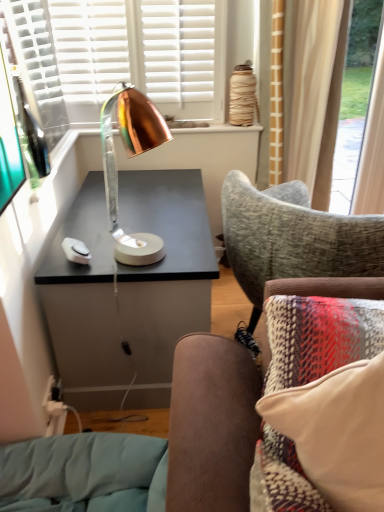
You are a GUI agent. You are given a task and a screenshot of the screen. Output one action in this format:
    pyautogui.click(x=<x>, y=<y>)
    Task: Click on the white soft pillow at lower right
    This screenshot has height=512, width=384.
    Given the screenshot: What is the action you would take?
    [x=337, y=432]

The image size is (384, 512). What do you see at coordinates (337, 432) in the screenshot? I see `white soft pillow at lower right` at bounding box center [337, 432].

Image resolution: width=384 pixels, height=512 pixels. What do you see at coordinates (130, 156) in the screenshot?
I see `copper metallic lamp at center` at bounding box center [130, 156].

Locate an element on the screen. The image size is (384, 512). copper metallic lamp at center is located at coordinates (130, 156).

Where is `white soft pillow at lower right`? This screenshot has width=384, height=512. white soft pillow at lower right is located at coordinates (337, 432).

Is white soft pillow at lower right at the right side of copper metallic lamp at center?

Yes.

Is white soft pillow at lower right in front of or behind copper metallic lamp at center in the image?

white soft pillow at lower right is in front of copper metallic lamp at center.

Does point (337, 475) come in front of point (158, 135)?

Yes, point (337, 475) is in front of point (158, 135).

From the image's perspective, is white soft pillow at lower right over copper metallic lamp at center?

Actually, white soft pillow at lower right appears below copper metallic lamp at center in the image.

From a real-world perspective, is white soft pillow at lower right positioned above or below copper metallic lamp at center?

white soft pillow at lower right is situated lower than copper metallic lamp at center in the real world.

Between white soft pillow at lower right and copper metallic lamp at center, which one has larger width?

Wider between the two is white soft pillow at lower right.

From the picture: In terms of height, does white soft pillow at lower right look taller or shorter compared to copper metallic lamp at center?

Clearly, white soft pillow at lower right is shorter compared to copper metallic lamp at center.

Is white soft pillow at lower right smaller than copper metallic lamp at center?

No.

Is white soft pillow at lower right not within copper metallic lamp at center?

Yes, white soft pillow at lower right is located beyond the bounds of copper metallic lamp at center.

Is the surface of white soft pillow at lower right in direct contact with copper metallic lamp at center?

No, white soft pillow at lower right is not next to copper metallic lamp at center.

Is white soft pillow at lower right looking in the opposite direction of copper metallic lamp at center?

white soft pillow at lower right does not have its back to copper metallic lamp at center.

Locate an element on the screen. This screenshot has height=512, width=384. pillow in front of the copper metallic lamp at center is located at coordinates (337, 432).

Consider the image. Is copper metallic lamp at center to the right of white soft pillow at lower right from the viewer's perspective?

Incorrect, copper metallic lamp at center is not on the right side of white soft pillow at lower right.

Is copper metallic lamp at center closer to camera compared to white soft pillow at lower right?

Answer: No, it is not.

Which point is more forward, (129, 93) or (340, 478)?

The point (340, 478) is more forward.

From the image's perspective, is copper metallic lamp at center positioned above or below white soft pillow at lower right?

Based on their image positions, copper metallic lamp at center is located above white soft pillow at lower right.

From a real-world perspective, is copper metallic lamp at center below white soft pillow at lower right?

No.

Is copper metallic lamp at center thinner than white soft pillow at lower right?

Indeed, copper metallic lamp at center has a lesser width compared to white soft pillow at lower right.

Does copper metallic lamp at center have a lesser height compared to white soft pillow at lower right?

No.

Does copper metallic lamp at center have a smaller size compared to white soft pillow at lower right?

Yes.

Is copper metallic lamp at center not within white soft pillow at lower right?

copper metallic lamp at center lies outside white soft pillow at lower right's area.

Is copper metallic lamp at center positioned far away from white soft pillow at lower right?

No.

Is copper metallic lamp at center facing away from white soft pillow at lower right?

No, copper metallic lamp at center's orientation is not away from white soft pillow at lower right.

What's the angular difference between copper metallic lamp at center and white soft pillow at lower right's facing directions?

They differ by 2.61 degrees in their facing directions.

Find the location of a particular element. This screenshot has height=512, width=384. pillow that is under the copper metallic lamp at center (from a real-world perspective) is located at coordinates (337, 432).

Find the location of a particular element. lamp that is behind the white soft pillow at lower right is located at coordinates (130, 156).

You are a GUI agent. You are given a task and a screenshot of the screen. Output one action in this format:
    pyautogui.click(x=<x>, y=<y>)
    Task: Click on the pillow in front of the copper metallic lamp at center
    
    Given the screenshot: What is the action you would take?
    pyautogui.click(x=337, y=432)